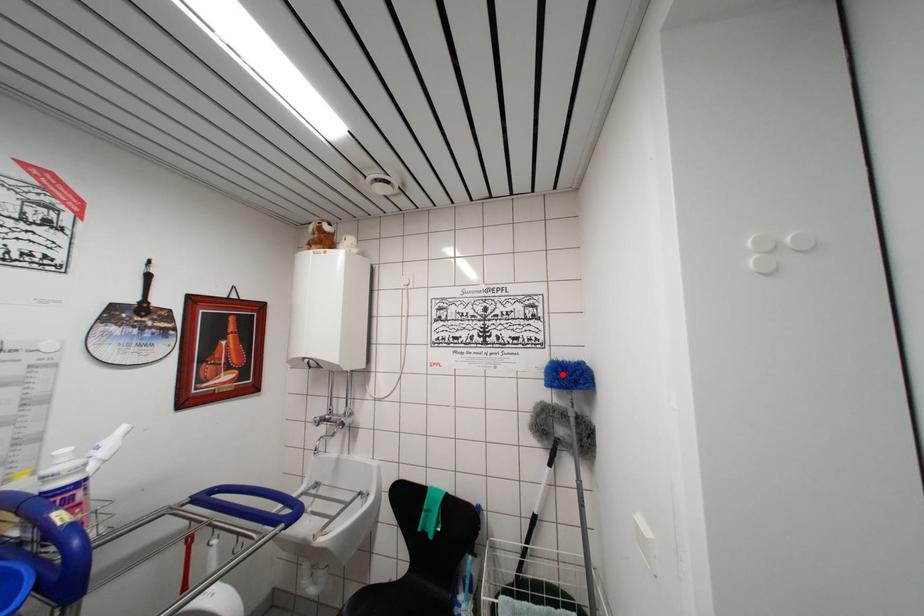
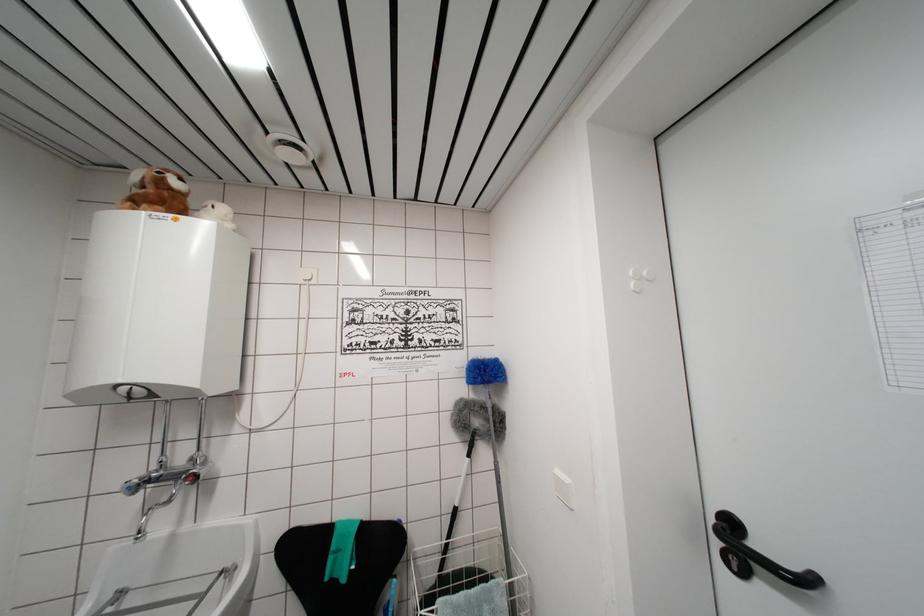
The point at the highlighted location is marked in the first image. Where is the corresponding point in the second image?

(484, 371)